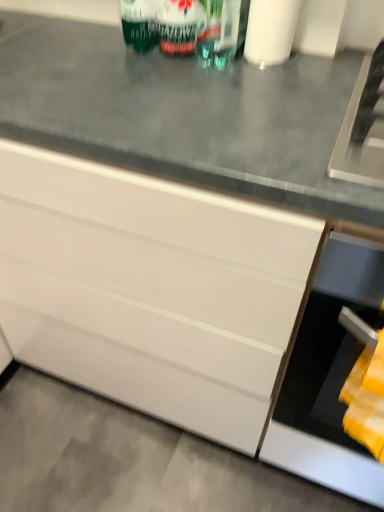
Identify the location of vacant space that is to the left of white matte toilet paper at upper center. Image resolution: width=384 pixels, height=512 pixels. (177, 72).